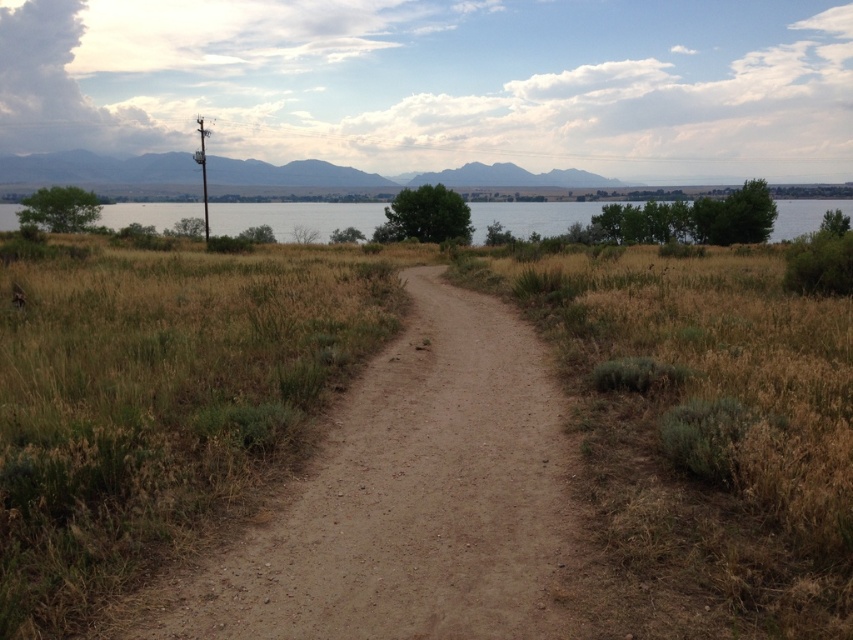
Does dull brown dirt track at center appear under clear water at upper center?

Correct, dull brown dirt track at center is located below clear water at upper center.

Consider the image. Measure the distance from dull brown dirt track at center to clear water at upper center.

dull brown dirt track at center is 75.13 meters away from clear water at upper center.

Between point (428, 296) and point (596, 202), which one is positioned in front?

Point (428, 296) is more forward.

Locate an element on the screen. dull brown dirt track at center is located at coordinates (405, 500).